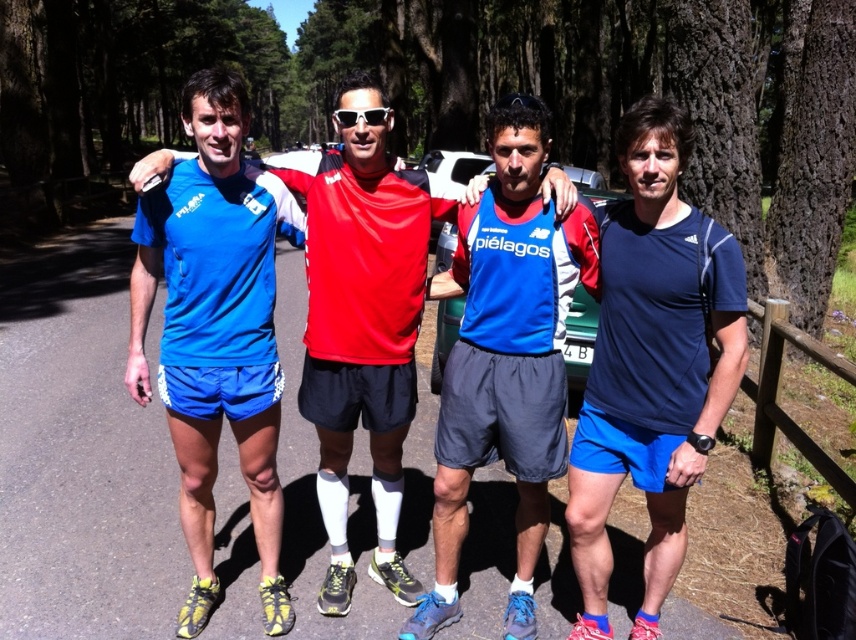
Based on the scene description, where is the smooth bark tree at center located in terms of coordinates?

The smooth bark tree at center is located at coordinates point (x=462, y=92).

You are a hiker who wants to take a photo of the smooth bark tree at center and the blue matte shorts at center. Based on their positions, which object should appear in front of the other in the photo?

The smooth bark tree at center is positioned over blue matte shorts at center, so the smooth bark tree at center should appear in front of the blue matte shorts at center in the photo.